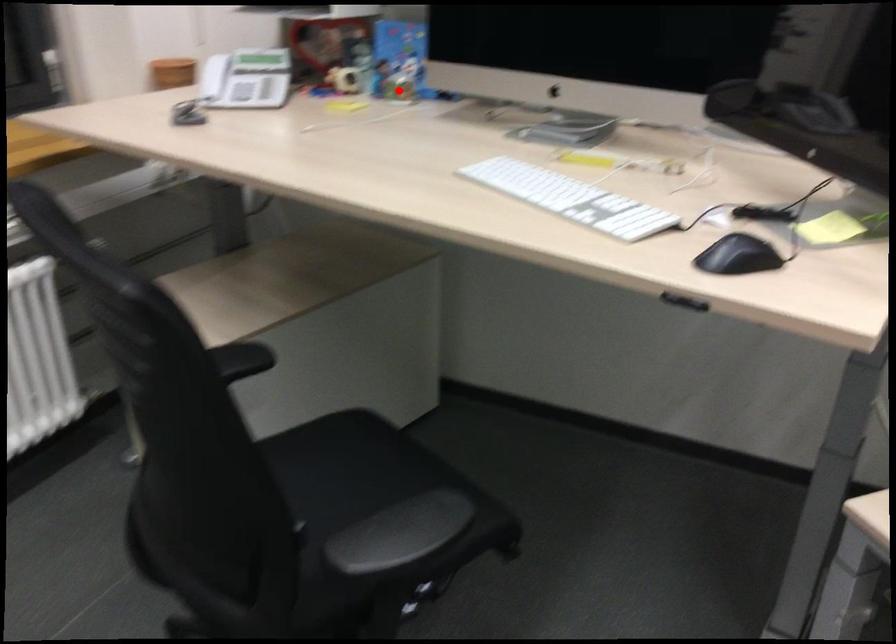
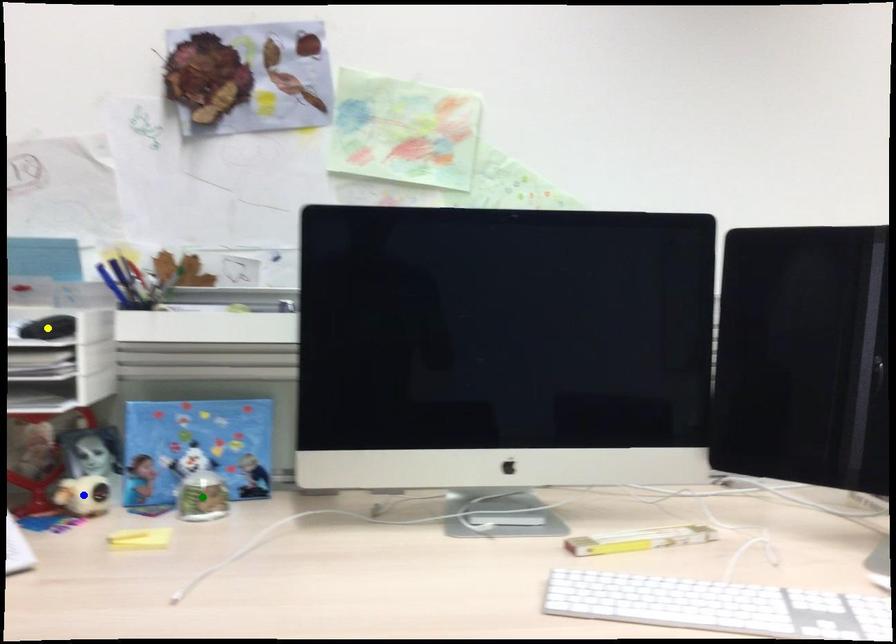
Question: I am providing you with two images of the same scene from different viewpoints. A red point is marked on the first image. You are given multiple points on the second image. Which spot in image 2 lines up with the point in image 1?

Choices:
 (A) green point
 (B) yellow point
 (C) blue point

Answer: (A)